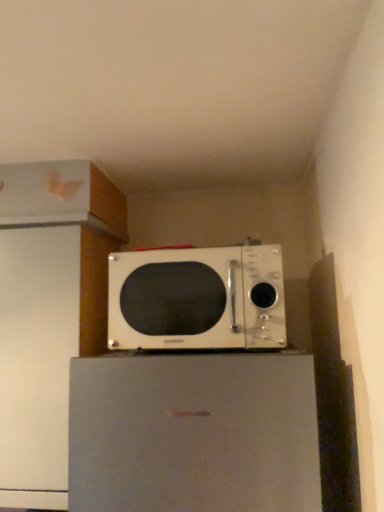
Question: Is white glossy microwave at center aimed at white matte refrigerator at center?

Choices:
 (A) yes
 (B) no

Answer: (B)

Question: From the image's perspective, is white glossy microwave at center located beneath white matte refrigerator at center?

Choices:
 (A) yes
 (B) no

Answer: (B)

Question: Is white glossy microwave at center thinner than white matte refrigerator at center?

Choices:
 (A) yes
 (B) no

Answer: (A)

Question: Can you confirm if white glossy microwave at center is wider than white matte refrigerator at center?

Choices:
 (A) yes
 (B) no

Answer: (B)

Question: Are white glossy microwave at center and white matte refrigerator at center located far from each other?

Choices:
 (A) yes
 (B) no

Answer: (B)

Question: Are white glossy microwave at center and white matte refrigerator at center making contact?

Choices:
 (A) yes
 (B) no

Answer: (B)

Question: Is white matte refrigerator at center touching white glossy microwave at center?

Choices:
 (A) yes
 (B) no

Answer: (B)

Question: From the image's perspective, would you say white matte refrigerator at center is positioned over white glossy microwave at center?

Choices:
 (A) no
 (B) yes

Answer: (A)

Question: From a real-world perspective, is white matte refrigerator at center located beneath white glossy microwave at center?

Choices:
 (A) yes
 (B) no

Answer: (A)

Question: Considering the relative positions of white matte refrigerator at center and white glossy microwave at center in the image provided, is white matte refrigerator at center to the right of white glossy microwave at center from the viewer's perspective?

Choices:
 (A) yes
 (B) no

Answer: (A)

Question: From a real-world perspective, is white matte refrigerator at center on top of white glossy microwave at center?

Choices:
 (A) no
 (B) yes

Answer: (A)

Question: Does white matte refrigerator at center have a lesser width compared to white glossy microwave at center?

Choices:
 (A) yes
 (B) no

Answer: (B)

Question: Relative to white matte refrigerator at center, is white glossy microwave at center in front or behind?

Choices:
 (A) front
 (B) behind

Answer: (B)